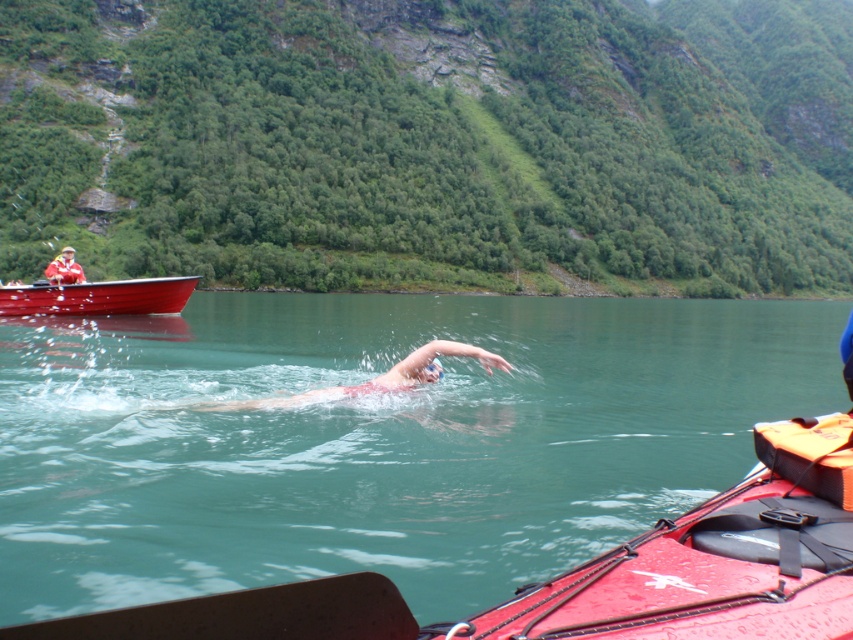
Question: Among these points, which one is nearest to the camera?

Choices:
 (A) (73, 257)
 (B) (558, 566)

Answer: (B)

Question: Is shiny red boat at left bigger than matte red jacket at upper left?

Choices:
 (A) no
 (B) yes

Answer: (A)

Question: Which point is closer to the camera taking this photo?

Choices:
 (A) (489, 365)
 (B) (62, 250)
 (C) (146, 310)

Answer: (A)

Question: Does green smooth water at center have a greater width compared to matte red jacket at upper left?

Choices:
 (A) no
 (B) yes

Answer: (B)

Question: Is shiny red boat at left to the right of matte red jacket at upper left from the viewer's perspective?

Choices:
 (A) no
 (B) yes

Answer: (B)

Question: Which point appears closest to the camera in this image?

Choices:
 (A) (381, 385)
 (B) (47, 275)
 (C) (74, 305)

Answer: (A)